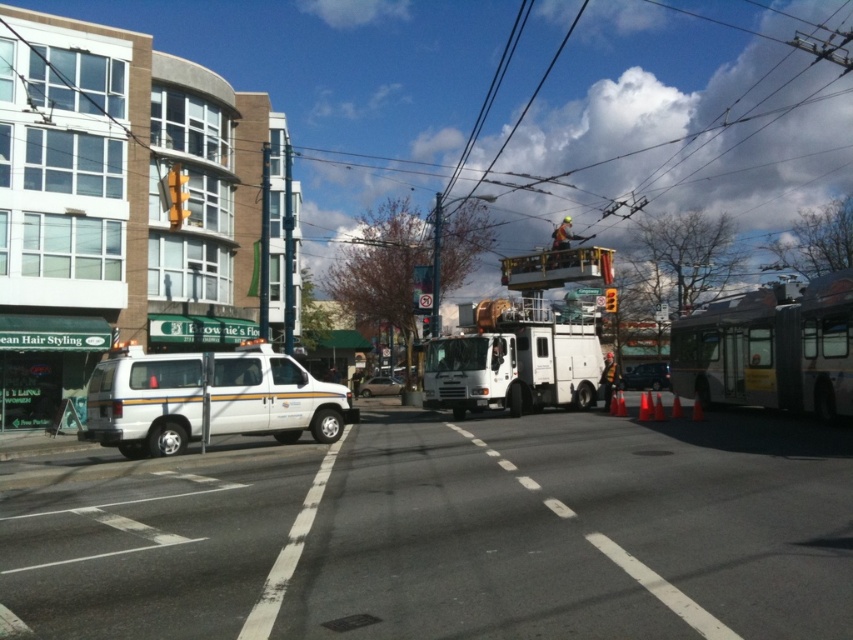
Does point (741, 385) come farther from viewer compared to point (614, 292)?

No, it is in front of (614, 292).

The width and height of the screenshot is (853, 640). I want to click on yellow/gold metallic bus at right, so pyautogui.click(x=770, y=348).

Is white utility truck at center above yellow plastic traffic light at center?

Actually, white utility truck at center is below yellow plastic traffic light at center.

Is white utility truck at center wider than yellow plastic traffic light at center?

Yes.

Locate an element on the screen. The height and width of the screenshot is (640, 853). white utility truck at center is located at coordinates (514, 362).

I want to click on white utility truck at center, so click(514, 362).

Between white glossy van at center and yellow matte traffic light at upper center, which one appears on the left side from the viewer's perspective?

yellow matte traffic light at upper center

Can you confirm if white glossy van at center is thinner than yellow matte traffic light at upper center?

Yes.

In the scene shown: Who is more forward, (212, 397) or (172, 186)?

Point (212, 397)

The height and width of the screenshot is (640, 853). In order to click on white glossy van at center in this screenshot , I will do `click(207, 400)`.